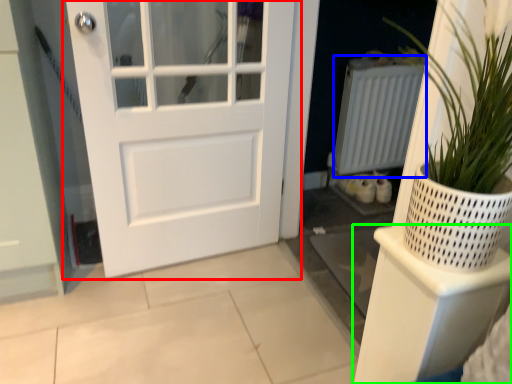
Question: Which is nearer to the door (highlighted by a red box)? radiator (highlighted by a blue box) or shelf (highlighted by a green box).

Choices:
 (A) radiator
 (B) shelf

Answer: (A)